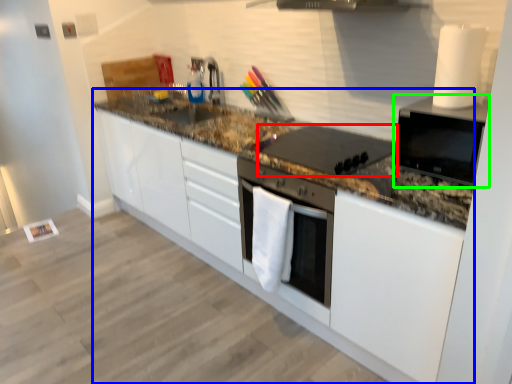
Question: Estimate the real-world distances between objects in this image. Which object is farther from kitchen appliance (highlighted by a red box), countertop (highlighted by a blue box) or home appliance (highlighted by a green box)?

Choices:
 (A) countertop
 (B) home appliance

Answer: (B)